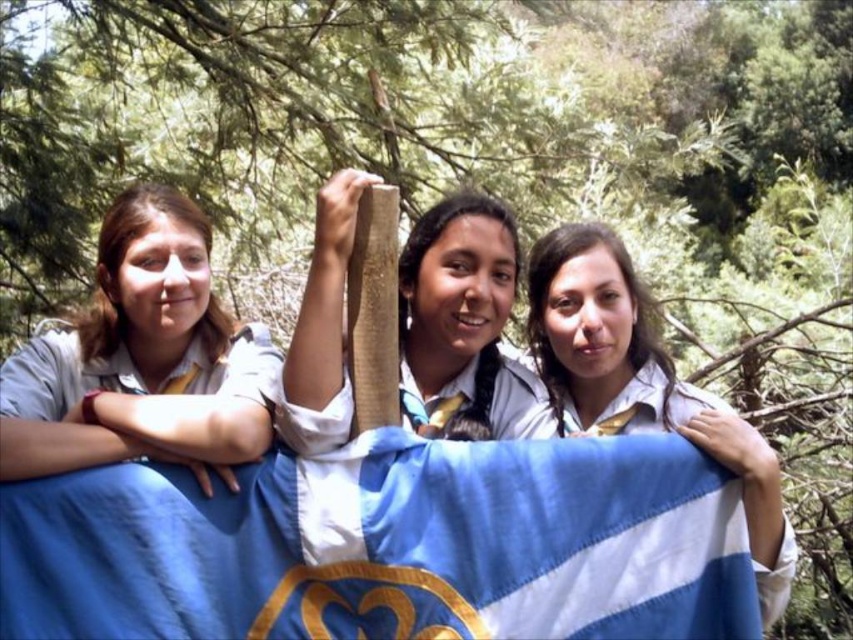
Between point (338, 508) and point (78, 365), which one is positioned behind?

The point (78, 365) is behind.

Does blue fabric flag at center have a greater width compared to light brown shirt at left?

Correct, the width of blue fabric flag at center exceeds that of light brown shirt at left.

Which is behind, point (698, 582) or point (189, 198)?

Point (189, 198)

This screenshot has width=853, height=640. What are the coordinates of `blue fabric flag at center` in the screenshot? It's located at (387, 545).

Is the position of light brown shirt at left more distant than that of blue striped fabric at center?

No, it is not.

Does point (45, 410) come farther from viewer compared to point (552, 291)?

No, (45, 410) is closer to viewer.

Is point (177, 355) positioned after point (564, 381)?

No, it is not.

Identify the location of light brown shirt at left. This screenshot has width=853, height=640. [x=142, y=358].

Is matte wooden stick at center above blue striped fabric at center?

Correct, matte wooden stick at center is located above blue striped fabric at center.

From the picture: Who is positioned more to the right, matte wooden stick at center or blue striped fabric at center?

Positioned to the right is blue striped fabric at center.

The image size is (853, 640). Describe the element at coordinates (463, 326) in the screenshot. I see `matte wooden stick at center` at that location.

This screenshot has height=640, width=853. In order to click on matte wooden stick at center in this screenshot , I will do `click(463, 326)`.